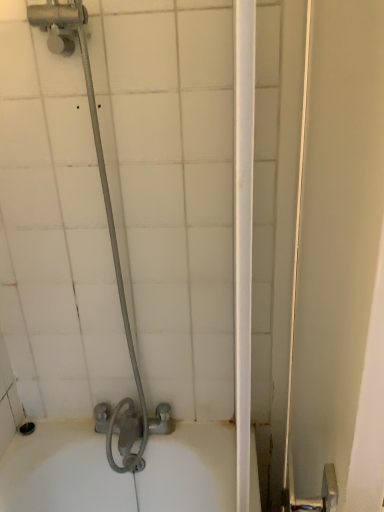
Measure the distance between point (306, 263) and camera.

They are 32.95 inches apart.

Describe the element at coordinates (330, 253) in the screenshot. Image resolution: width=384 pixels, height=512 pixels. I see `white glossy screen door at right` at that location.

Where is `white glossy screen door at right`? white glossy screen door at right is located at coordinates (330, 253).

Describe the element at coordinates (111, 245) in the screenshot. I see `metallic gray showerhead at left` at that location.

Find the location of a particular element. The width and height of the screenshot is (384, 512). metallic gray showerhead at left is located at coordinates (111, 245).

At what (x,y) coordinates should I click in order to perform the action: click on white glossy screen door at right. Please return your answer as a coordinate pair (x, y). The width and height of the screenshot is (384, 512). Looking at the image, I should click on [330, 253].

Considering the relative positions of white glossy screen door at right and metallic gray showerhead at left in the image provided, is white glossy screen door at right to the right of metallic gray showerhead at left from the viewer's perspective?

Yes, white glossy screen door at right is to the right of metallic gray showerhead at left.

Who is more distant, white glossy screen door at right or metallic gray showerhead at left?

metallic gray showerhead at left is behind.

Between point (331, 118) and point (63, 24), which one is positioned in front?

The point (331, 118) is in front.

From the image's perspective, which is below, white glossy screen door at right or metallic gray showerhead at left?

white glossy screen door at right is shown below in the image.

From a real-world perspective, who is located higher, white glossy screen door at right or metallic gray showerhead at left?

In real-world perspective, metallic gray showerhead at left is above.

Which object is wider, white glossy screen door at right or metallic gray showerhead at left?

metallic gray showerhead at left.

Considering the relative sizes of white glossy screen door at right and metallic gray showerhead at left in the image provided, is white glossy screen door at right taller than metallic gray showerhead at left?

Yes, white glossy screen door at right is taller than metallic gray showerhead at left.

Which of these two, white glossy screen door at right or metallic gray showerhead at left, is bigger?

Bigger between the two is white glossy screen door at right.

Is white glossy screen door at right inside or outside of metallic gray showerhead at left?

white glossy screen door at right cannot be found inside metallic gray showerhead at left.

Based on the photo, would you say white glossy screen door at right is a long distance from metallic gray showerhead at left?

Actually, white glossy screen door at right and metallic gray showerhead at left are a little close together.

Could you tell me if white glossy screen door at right is turned towards metallic gray showerhead at left?

No.

What's the angular difference between white glossy screen door at right and metallic gray showerhead at left's facing directions?

There is a 84.2-degree angle between the facing directions of white glossy screen door at right and metallic gray showerhead at left.

Locate an element on the screen. This screenshot has width=384, height=512. shower that is on the left side of white glossy screen door at right is located at coordinates (111, 245).

Which is more to the right, metallic gray showerhead at left or white glossy screen door at right?

From the viewer's perspective, white glossy screen door at right appears more on the right side.

In the image, is metallic gray showerhead at left positioned in front of or behind white glossy screen door at right?

In the image, metallic gray showerhead at left appears behind white glossy screen door at right.

Which point is more distant from viewer, (114, 468) or (356, 264)?

The point (114, 468) is farther.

From the image's perspective, is metallic gray showerhead at left positioned above or below white glossy screen door at right?

metallic gray showerhead at left is situated higher than white glossy screen door at right in the image.

From a real-world perspective, is metallic gray showerhead at left over white glossy screen door at right?

Correct, in the physical world, metallic gray showerhead at left is higher than white glossy screen door at right.

Is metallic gray showerhead at left wider than white glossy screen door at right?

Yes.

Does metallic gray showerhead at left have a greater height compared to white glossy screen door at right?

In fact, metallic gray showerhead at left may be shorter than white glossy screen door at right.

Who is smaller, metallic gray showerhead at left or white glossy screen door at right?

Smaller between the two is metallic gray showerhead at left.

Could white glossy screen door at right be considered to be inside metallic gray showerhead at left?

No.

Is metallic gray showerhead at left next to white glossy screen door at right and touching it?

No, metallic gray showerhead at left is not in contact with white glossy screen door at right.

Is metallic gray showerhead at left aimed at white glossy screen door at right?

No, metallic gray showerhead at left is not aimed at white glossy screen door at right.

Measure the distance from metallic gray showerhead at left to white glossy screen door at right.

They are 20.28 inches apart.

What are the coordinates of `shower that appears on the left of white glossy screen door at right` in the screenshot? It's located at (111, 245).

Where is `screen door below the metallic gray showerhead at left (from the image's perspective)`? Image resolution: width=384 pixels, height=512 pixels. screen door below the metallic gray showerhead at left (from the image's perspective) is located at coordinates (330, 253).

Identify the location of screen door located in front of the metallic gray showerhead at left. (330, 253).